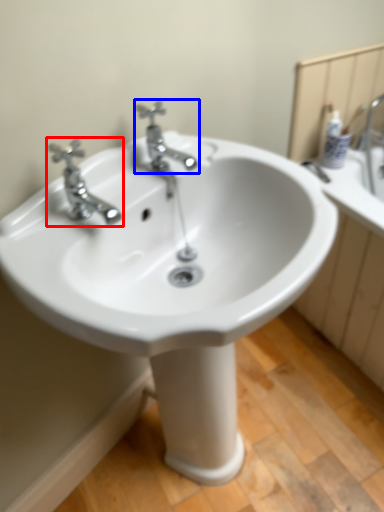
Question: Which of the following is the farthest to the observer, tap (highlighted by a red box) or tap (highlighted by a blue box)?

Choices:
 (A) tap
 (B) tap

Answer: (B)